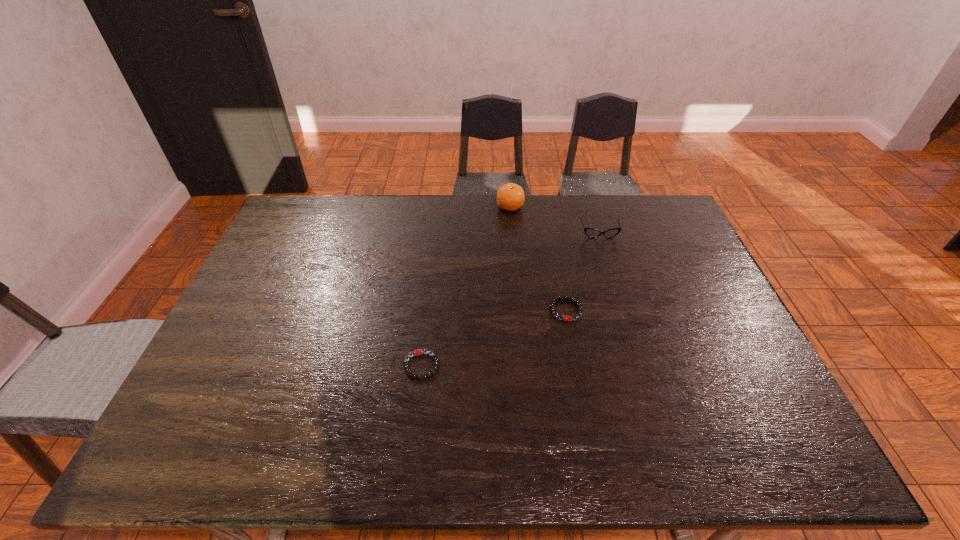
Where is `the second closest object to the nearer bracelet`? The width and height of the screenshot is (960, 540). the second closest object to the nearer bracelet is located at coordinates (510, 197).

Find the location of a particular element. the second closest object to the second tallest object is located at coordinates (566, 318).